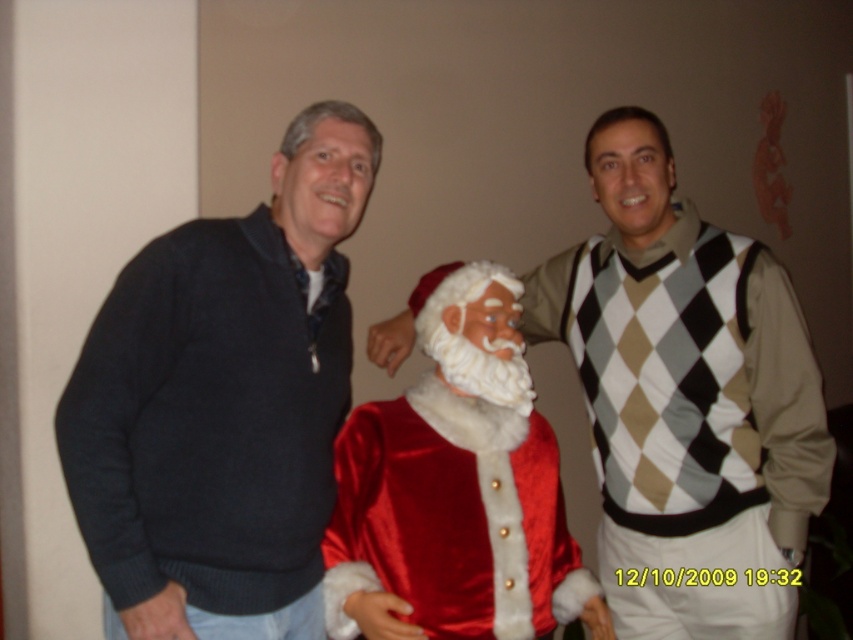
Question: Does satin santa at center appear on the right side of velvet santa claus at center?

Choices:
 (A) yes
 (B) no

Answer: (A)

Question: Which point is closer to the camera?

Choices:
 (A) (151, 524)
 (B) (506, 358)
 (C) (662, 289)

Answer: (A)

Question: Does dark gray sweater at left appear on the right side of satin santa at center?

Choices:
 (A) no
 (B) yes

Answer: (A)

Question: Observing the image, what is the correct spatial positioning of dark gray sweater at left in reference to velvet santa claus at center?

Choices:
 (A) below
 (B) above

Answer: (B)

Question: Which point appears closest to the camera in this image?

Choices:
 (A) (215, 388)
 (B) (485, 392)

Answer: (A)

Question: Which of these objects is positioned farthest from the dark gray sweater at left?

Choices:
 (A) satin santa at center
 (B) velvet santa claus at center

Answer: (A)